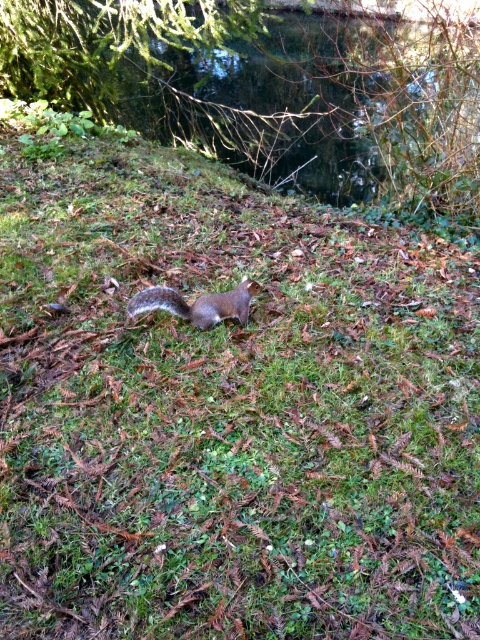
Question: Is green mossy tree at upper left positioned at the back of gray-furred squirrel at center?

Choices:
 (A) yes
 (B) no

Answer: (A)

Question: Is green mossy tree at upper left smaller than gray furry tail at center?

Choices:
 (A) yes
 (B) no

Answer: (B)

Question: Which point is closer to the camera?

Choices:
 (A) green mossy tree at upper left
 (B) gray-furred squirrel at center

Answer: (B)

Question: Can you confirm if green mossy tree at upper left is wider than gray-furred squirrel at center?

Choices:
 (A) yes
 (B) no

Answer: (A)

Question: Which point is closer to the camera taking this photo?

Choices:
 (A) (141, 298)
 (B) (309, 116)

Answer: (A)

Question: Which point appears closest to the camera in this image?

Choices:
 (A) (152, 285)
 (B) (149, 301)
 (C) (210, 19)

Answer: (B)